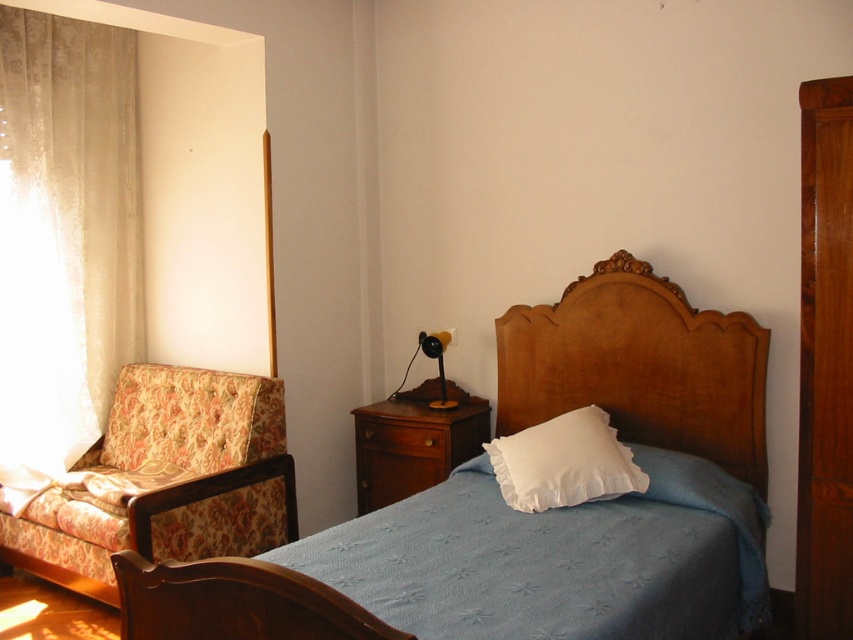
You are a guest in this bedroom and want to sit down. You see the floral fabric armchair at left and the wooden dresser at center. Which one is lower in height so you can sit on it?

The floral fabric armchair at left is shorter than the wooden dresser at center, so it is lower in height and suitable for sitting.

You are standing in the bedroom and want to place a new bookshelf between the blue textured blanket at center and the wooden headboard at center. Based on their positions, which object should the bookshelf be placed closer to?

The blue textured blanket at center is positioned on the left side of wooden headboard at center, so the bookshelf should be placed closer to the wooden headboard at center to maintain the existing arrangement.

Looking at this image, you are trying to decide where to place a new decorative pillow. The blue textured blanket at center is shorter than the wooden headboard at center. Which object would allow the pillow to be more visible from the doorway?

The blue textured blanket at center is shorter than the wooden headboard at center, so placing the decorative pillow on the wooden headboard at center would make it more visible from the doorway since it is taller.